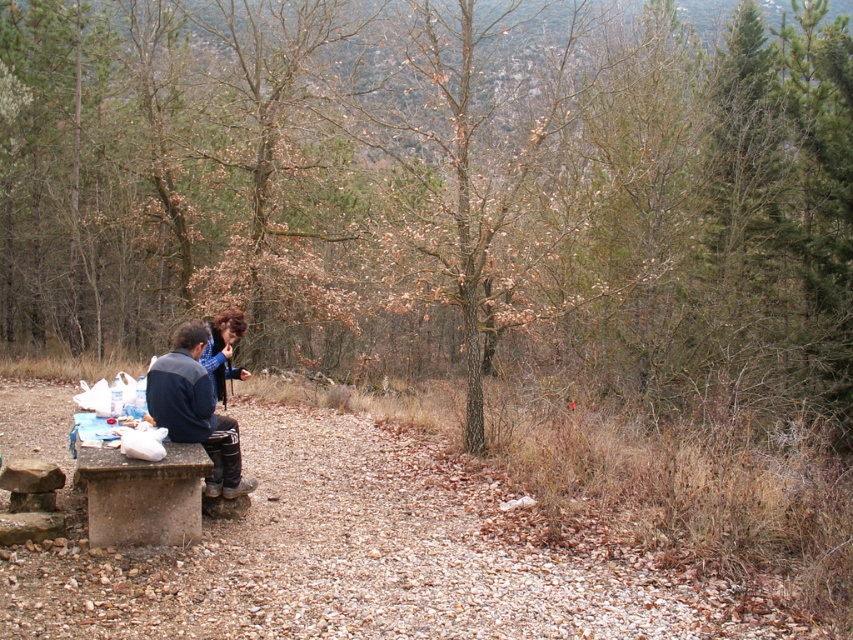
Based on the photo, does brown bark tree at center come in front of concrete bench at lower left?

No, it is behind concrete bench at lower left.

Can you confirm if brown bark tree at center is positioned to the right of concrete bench at lower left?

Indeed, brown bark tree at center is positioned on the right side of concrete bench at lower left.

Who is more forward, (683, 170) or (84, 470)?

Point (84, 470) is more forward.

This screenshot has height=640, width=853. I want to click on brown bark tree at center, so click(x=438, y=189).

Does point (45, 134) come behind point (694, 628)?

Yes, it is.

Is point (447, 60) positioned before point (508, 496)?

No, it is not.

Locate an element on the screen. This screenshot has width=853, height=640. brown bark tree at center is located at coordinates 438,189.

Image resolution: width=853 pixels, height=640 pixels. In order to click on brown bark tree at center in this screenshot , I will do `click(438, 189)`.

Who is positioned more to the right, concrete bench at lower left or dark blue jacket at left?

From the viewer's perspective, dark blue jacket at left appears more on the right side.

You are a GUI agent. You are given a task and a screenshot of the screen. Output one action in this format:
    pyautogui.click(x=<x>, y=<y>)
    Task: Click on the concrete bench at lower left
    Image resolution: width=853 pixels, height=640 pixels.
    Given the screenshot: What is the action you would take?
    pyautogui.click(x=142, y=496)

At what (x,y) coordinates should I click in order to perform the action: click on concrete bench at lower left. Please return your answer as a coordinate pair (x, y). Looking at the image, I should click on [x=142, y=496].